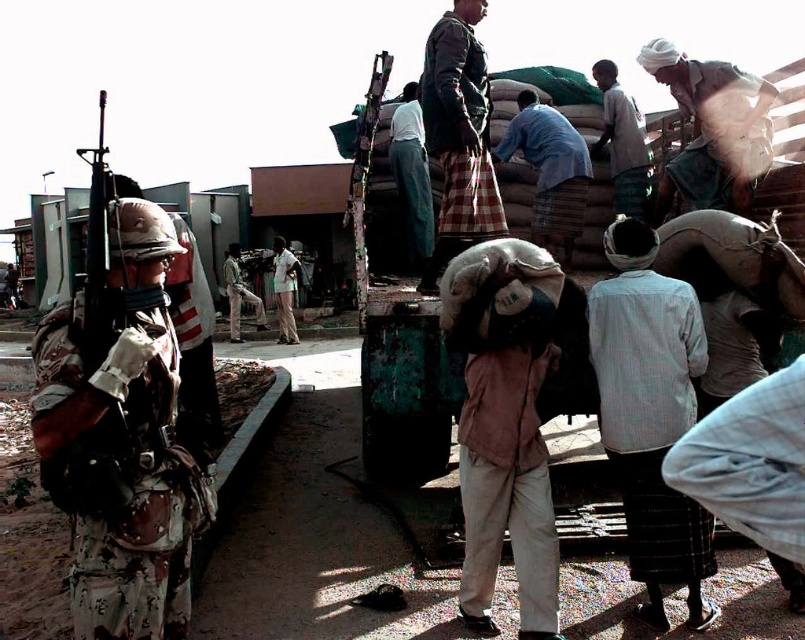
You are a photographer trying to capture a candid shot of the green plaid shirt at upper right and the camouflage uniform at center. Which of the two subjects should you focus on if you want to photograph the smaller one?

The green plaid shirt at upper right is smaller than the camouflage uniform at center, so you should focus on the green plaid shirt at upper right to photograph the smaller one.

You are a photographer trying to capture a detailed shot of both the white cotton turban at upper right and the light blue fabric pants at center. Since you want to ensure both are clearly visible in your photo, which object should you focus on first to account for their sizes?

The white cotton turban at upper right is larger than the light blue fabric pants at center, so you should focus on the white cotton turban at upper right first as it requires more attention due to its size to ensure clarity in the photograph.